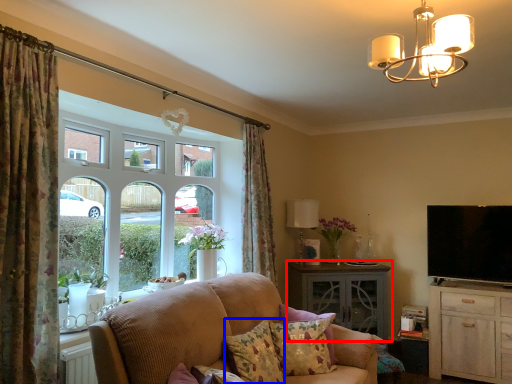
Question: Which object appears farthest to the camera in this image, table (highlighted by a red box) or pillow (highlighted by a blue box)?

Choices:
 (A) table
 (B) pillow

Answer: (A)